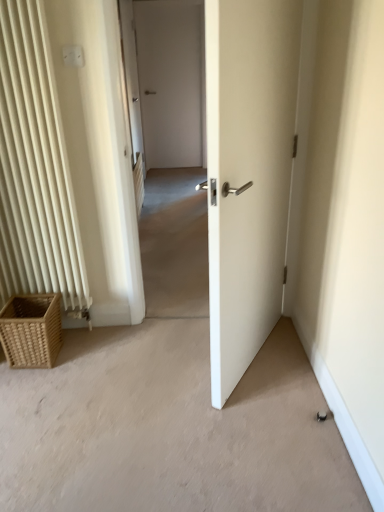
Question: Is woven brown picnic basket at lower left in front of or behind white plastic electric outlet at upper left in the image?

Choices:
 (A) behind
 (B) front

Answer: (A)

Question: Considering the relative positions of woven brown picnic basket at lower left and white plastic electric outlet at upper left in the image provided, is woven brown picnic basket at lower left to the left or to the right of white plastic electric outlet at upper left?

Choices:
 (A) right
 (B) left

Answer: (B)

Question: Based on their sizes in the image, would you say woven brown picnic basket at lower left is bigger or smaller than white plastic electric outlet at upper left?

Choices:
 (A) small
 (B) big

Answer: (B)

Question: Is white plastic electric outlet at upper left spatially inside woven brown picnic basket at lower left, or outside of it?

Choices:
 (A) inside
 (B) outside

Answer: (B)

Question: Based on their sizes in the image, would you say white plastic electric outlet at upper left is bigger or smaller than woven brown picnic basket at lower left?

Choices:
 (A) small
 (B) big

Answer: (A)

Question: From the image's perspective, relative to woven brown picnic basket at lower left, is white plastic electric outlet at upper left above or below?

Choices:
 (A) below
 (B) above

Answer: (B)

Question: Is white plastic electric outlet at upper left wider or thinner than woven brown picnic basket at lower left?

Choices:
 (A) thin
 (B) wide

Answer: (A)